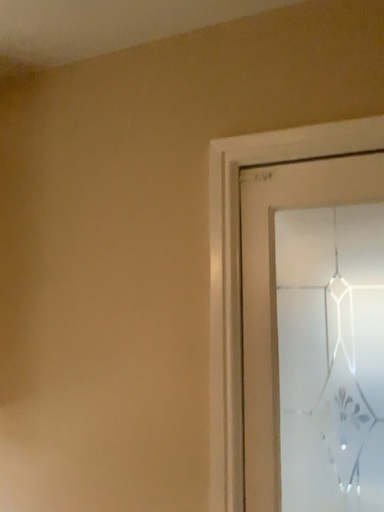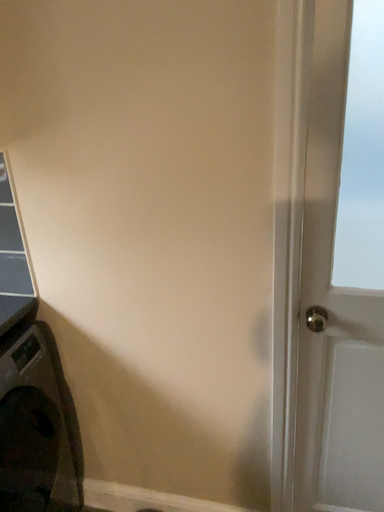
Question: How did the camera likely rotate when shooting the video?

Choices:
 (A) rotated left
 (B) rotated right

Answer: (B)